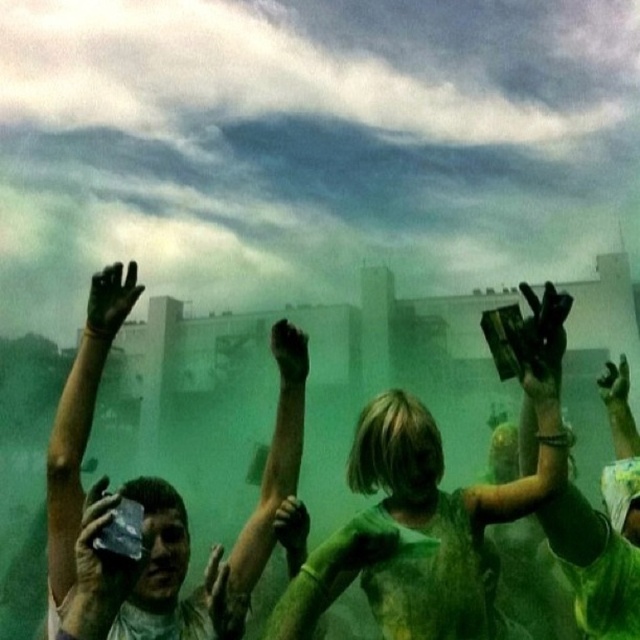
Question: Which point is closer to the camera?

Choices:
 (A) (76, 528)
 (B) (404, 637)

Answer: (A)

Question: Can you confirm if green matte/soft fabric at center is thinner than green painted hands at center?

Choices:
 (A) yes
 (B) no

Answer: (B)

Question: Can you confirm if green matte/soft fabric at center is smaller than green painted hands at center?

Choices:
 (A) yes
 (B) no

Answer: (B)

Question: Is green matte/soft fabric at center further to the viewer compared to green painted hands at center?

Choices:
 (A) yes
 (B) no

Answer: (A)

Question: Which of the following is the farthest from the observer?

Choices:
 (A) green painted hands at center
 (B) green matte/soft fabric at center

Answer: (B)